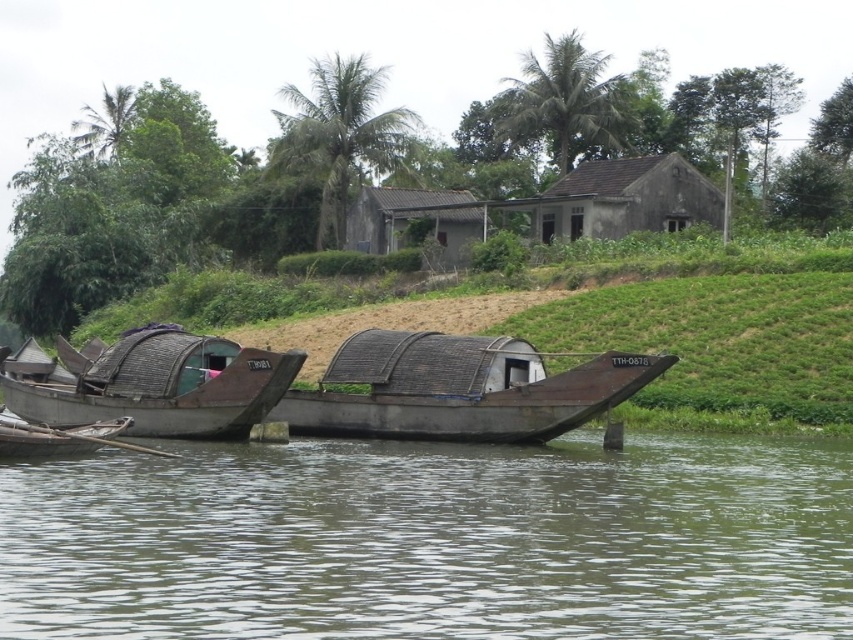
You are a photographer planning to take a photo of both the rusty metal boat at left and the rustic wooden hut at center. Since you want both objects to appear in the frame, which one should you position closer to the camera to ensure they are both visible and properly sized?

The rusty metal boat at left is smaller in size compared to the rustic wooden hut at center. To ensure both appear properly sized in the photo, you should position the rusty metal boat at left closer to the camera and the rustic wooden hut at center further back so their sizes in the frame are balanced.

You are a delivery person needing to cross the river from the rusty metal boat at center to the opposite bank. The water current is too strong for swimming. You have a 10 meter long rope. Can you use the rope to safely reach the other side using the brown matte water at center as your path?

The distance between the brown matte water at center and the rusty metal boat at center is 9.03 meters. Since the rope is 10 meters long, it is long enough to span the gap. Therefore, you can safely use the rope to cross the river.